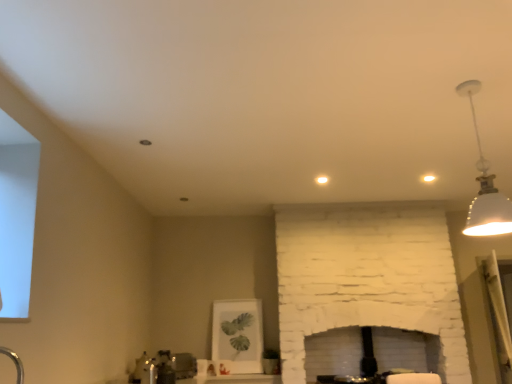
Where is `white glossy sink at lower center`? white glossy sink at lower center is located at coordinates (163, 368).

From the image's perspective, between white matte pendant light at upper right and satin nickel faucet at lower center, who is located below?

satin nickel faucet at lower center appears lower in the image.

Which object is thinner, white matte pendant light at upper right or satin nickel faucet at lower center?

Thinner between the two is satin nickel faucet at lower center.

Looking at this image, is white matte pendant light at upper right oriented towards satin nickel faucet at lower center?

No, white matte pendant light at upper right is not turned towards satin nickel faucet at lower center.

Is satin nickel faucet at lower center located within white matte pendant light at upper right?

No, satin nickel faucet at lower center is not surrounded by white matte pendant light at upper right.

Are white matte pendant light at upper right and white glossy sink at lower center located far from each other?

That's right, there is a large distance between white matte pendant light at upper right and white glossy sink at lower center.

What's the angular difference between white matte pendant light at upper right and white glossy sink at lower center's facing directions?

The facing directions of white matte pendant light at upper right and white glossy sink at lower center are 88 degrees apart.

Which is less distant, (475,86) or (144,371)?

Point (475,86) is positioned closer to the camera compared to point (144,371).

Considering the sizes of objects satin nickel faucet at lower center and white matte pendant light at upper right in the image provided, who is smaller, satin nickel faucet at lower center or white matte pendant light at upper right?

With smaller size is satin nickel faucet at lower center.

Consider the image. Considering the positions of objects satin nickel faucet at lower center and white matte pendant light at upper right in the image provided, who is behind, satin nickel faucet at lower center or white matte pendant light at upper right?

satin nickel faucet at lower center is behind.

From the image's perspective, which is below, satin nickel faucet at lower center or white matte pendant light at upper right?

satin nickel faucet at lower center, from the image's perspective.

Is the surface of white glossy sink at lower center in direct contact with satin nickel faucet at lower center?

There is a gap between white glossy sink at lower center and satin nickel faucet at lower center.

Considering the sizes of white glossy sink at lower center and satin nickel faucet at lower center in the image, is white glossy sink at lower center taller or shorter than satin nickel faucet at lower center?

In the image, white glossy sink at lower center appears to be taller than satin nickel faucet at lower center.

Considering the positions of points (162, 364) and (144, 367), is point (162, 364) farther from camera compared to point (144, 367)?

No, it is in front of (144, 367).

Find the location of a particular element. This screenshot has height=384, width=512. sink located below the satin nickel faucet at lower center (from the image's perspective) is located at coordinates (163, 368).

Is white matte pendant light at upper right at the back of white glossy sink at lower center?

That's not correct — white glossy sink at lower center is not looking away from white matte pendant light at upper right.

From the image's perspective, is white glossy sink at lower center positioned above or below white matte pendant light at upper right?

Based on their image positions, white glossy sink at lower center is located beneath white matte pendant light at upper right.

Can you tell me how much white glossy sink at lower center and white matte pendant light at upper right differ in facing direction?

They differ by 88 degrees in their facing directions.

Who is smaller, white glossy sink at lower center or white matte pendant light at upper right?

white glossy sink at lower center is smaller.

Between satin nickel faucet at lower center and white glossy sink at lower center, which one has larger size?

Bigger between the two is white glossy sink at lower center.

In the scene shown: Considering the relative sizes of satin nickel faucet at lower center and white glossy sink at lower center in the image provided, is satin nickel faucet at lower center wider than white glossy sink at lower center?

No, satin nickel faucet at lower center is not wider than white glossy sink at lower center.

Between satin nickel faucet at lower center and white glossy sink at lower center, which one is positioned in front?

Positioned in front is satin nickel faucet at lower center.

In the image, there is a white matte pendant light at upper right. Identify the location of faucet below it (from a real-world perspective). Image resolution: width=512 pixels, height=384 pixels. (149, 372).

This screenshot has height=384, width=512. Identify the location of lamp that appears above the white glossy sink at lower center (from the image's perspective). (485, 187).

Considering their positions, is white glossy sink at lower center positioned further to satin nickel faucet at lower center than white matte pendant light at upper right?

white matte pendant light at upper right lies further to satin nickel faucet at lower center than the other object.

Considering their positions, is white matte pendant light at upper right positioned closer to white glossy sink at lower center than satin nickel faucet at lower center?

The object closer to white glossy sink at lower center is satin nickel faucet at lower center.

Based on their spatial positions, is satin nickel faucet at lower center or white glossy sink at lower center further from white matte pendant light at upper right?

white glossy sink at lower center is further to white matte pendant light at upper right.

Considering their positions, is satin nickel faucet at lower center positioned closer to white glossy sink at lower center than white matte pendant light at upper right?

satin nickel faucet at lower center lies closer to white glossy sink at lower center than the other object.

From the image, which object appears to be farther from white matte pendant light at upper right, white glossy sink at lower center or satin nickel faucet at lower center?

white glossy sink at lower center.

From the image, which object appears to be nearer to satin nickel faucet at lower center, white matte pendant light at upper right or white glossy sink at lower center?

white glossy sink at lower center is positioned closer to the anchor satin nickel faucet at lower center.

Image resolution: width=512 pixels, height=384 pixels. I want to click on sink between satin nickel faucet at lower center and white matte pendant light at upper right in the horizontal direction, so click(163, 368).